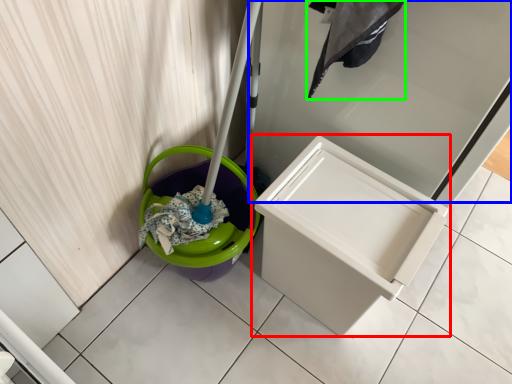
Question: Which is nearer to the waste container (highlighted by a red box)? screen door (highlighted by a blue box) or laundry (highlighted by a green box).

Choices:
 (A) screen door
 (B) laundry

Answer: (A)